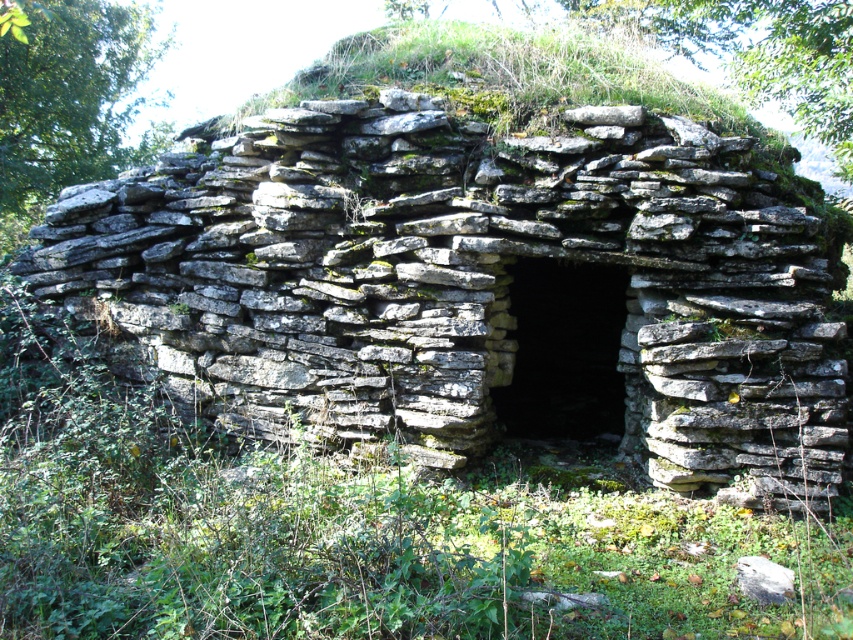
Question: Which point is closer to the camera?

Choices:
 (A) (415, 138)
 (B) (1, 333)

Answer: (A)

Question: Can you confirm if gray stone wall at center is wider than green mossy grass at center?

Choices:
 (A) yes
 (B) no

Answer: (A)

Question: Observing the image, what is the correct spatial positioning of gray stone wall at center in reference to green mossy grass at center?

Choices:
 (A) below
 (B) above

Answer: (B)

Question: Which object appears farthest from the camera in this image?

Choices:
 (A) gray stone wall at center
 (B) green mossy grass at center

Answer: (A)

Question: Does gray stone wall at center lie in front of green mossy grass at center?

Choices:
 (A) no
 (B) yes

Answer: (A)